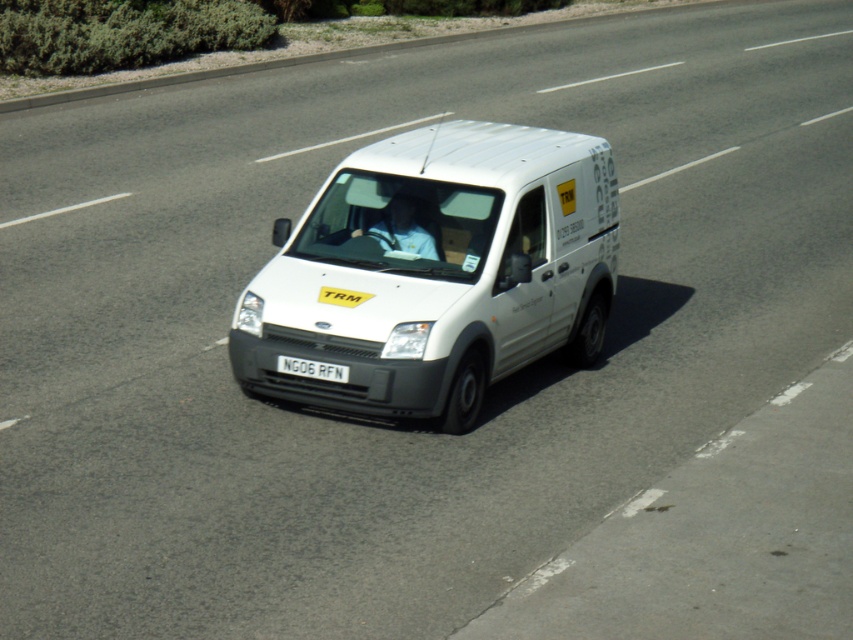
Can you confirm if white matte van at center is wider than white plastic license plate at center?

Yes.

Looking at this image, who is more forward, (473, 273) or (323, 365)?

Point (323, 365) is more forward.

This screenshot has width=853, height=640. Identify the location of white matte van at center. (436, 269).